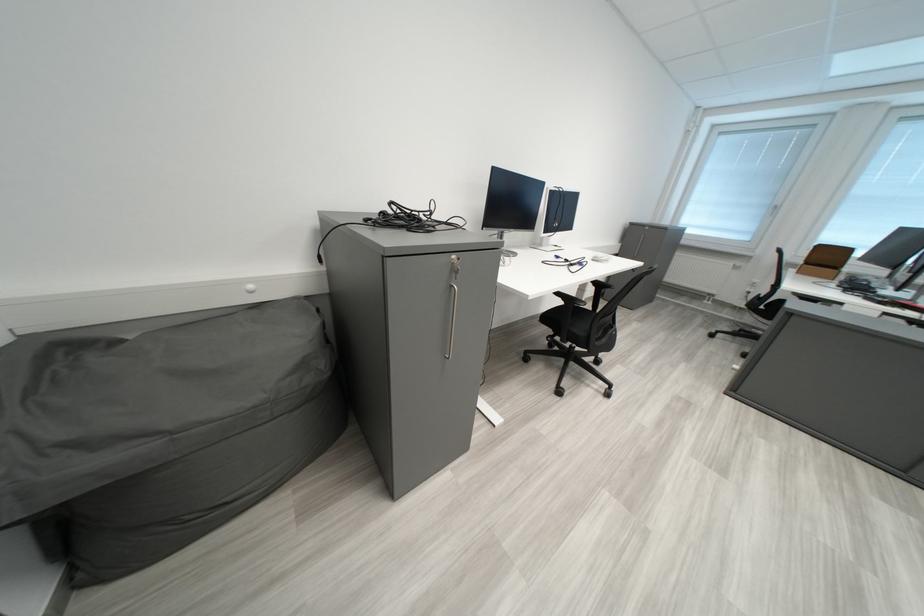
I want to click on silver cabinet handle, so click(453, 321).